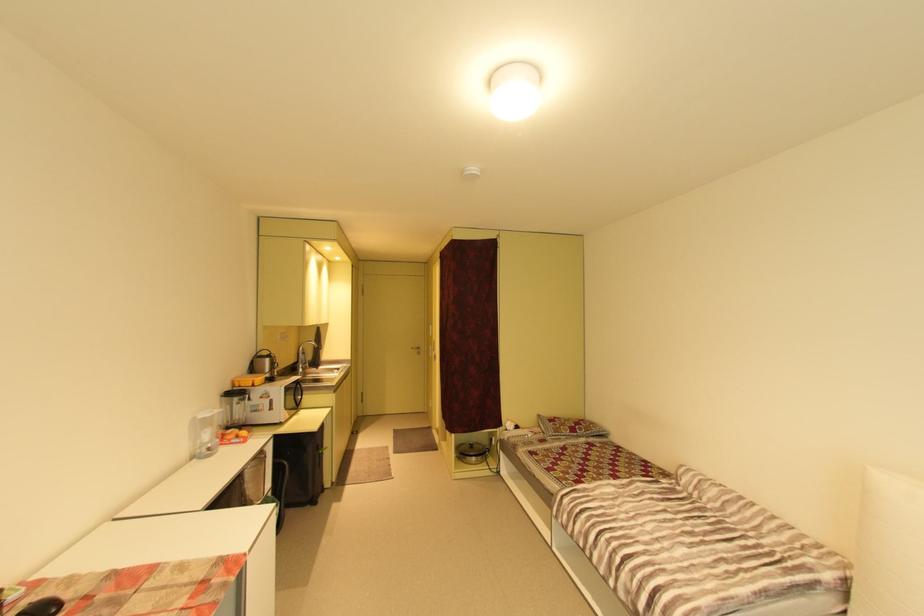
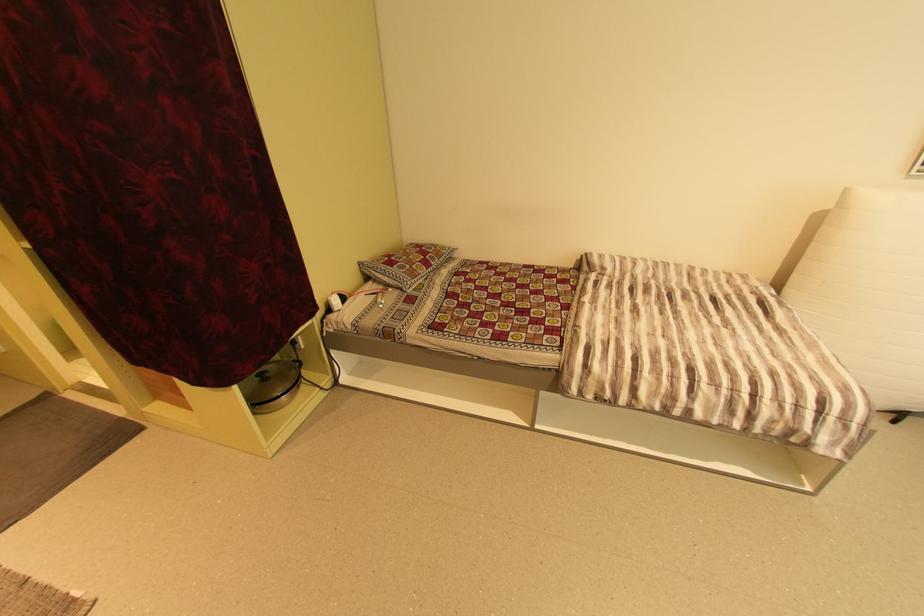
Find the pixel in the second image that matches the point at 568,428 in the first image.

(420, 267)